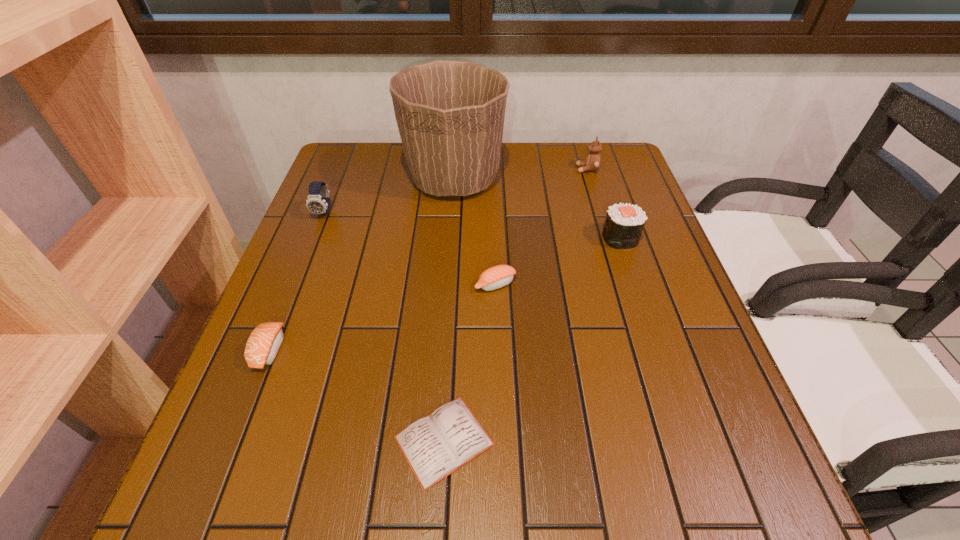
Locate an element on the screen. This screenshot has height=540, width=960. flowerpot is located at coordinates (450, 114).

Where is `teddy bear`? teddy bear is located at coordinates [592, 163].

You are a GUI agent. You are given a task and a screenshot of the screen. Output one action in this format:
    pyautogui.click(x=<x>, y=<y>)
    Task: Click on the watch
    Image resolution: width=960 pixels, height=540 pixels.
    Given the screenshot: What is the action you would take?
    pyautogui.click(x=318, y=202)

Identify the location of the tallest sushi. (624, 223).

Find the location of a particular element. This screenshot has width=960, height=540. the farthest sushi is located at coordinates (624, 223).

This screenshot has height=540, width=960. Identify the location of the fifth farthest object. (498, 276).

The width and height of the screenshot is (960, 540). What are the coordinates of `the second nearest sushi` in the screenshot? It's located at (498, 276).

Locate an element on the screen. The height and width of the screenshot is (540, 960). the leftmost sushi is located at coordinates (262, 346).

You are a GUI agent. You are given a task and a screenshot of the screen. Output one action in this format:
    pyautogui.click(x=<x>, y=<y>)
    Task: Click on the sixth farthest object
    Image resolution: width=960 pixels, height=540 pixels.
    Given the screenshot: What is the action you would take?
    pyautogui.click(x=262, y=346)

Identify the location of diary. (435, 446).